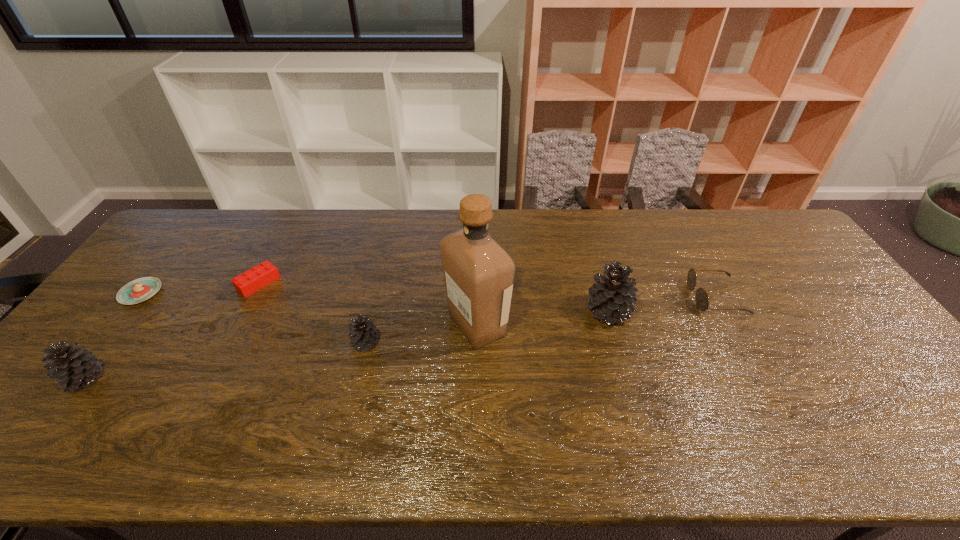
Where is `the leftmost pinecone`? This screenshot has width=960, height=540. the leftmost pinecone is located at coordinates (74, 367).

Where is `the third tallest object`? This screenshot has height=540, width=960. the third tallest object is located at coordinates (74, 367).

At what (x,y) coordinates should I click in order to perform the action: click on the shortest pinecone. Please return your answer as a coordinate pair (x, y). This screenshot has height=540, width=960. Looking at the image, I should click on (363, 334).

At what (x,y) coordinates should I click in order to perform the action: click on the fourth tallest object. Please return your answer as a coordinate pair (x, y). This screenshot has height=540, width=960. Looking at the image, I should click on (363, 334).

Image resolution: width=960 pixels, height=540 pixels. I want to click on the tallest pinecone, so click(x=612, y=298).

Where is `the sixth shortest object`? the sixth shortest object is located at coordinates (612, 298).

The height and width of the screenshot is (540, 960). What are the coordinates of `the third object from left to right` in the screenshot? It's located at (250, 281).

Where is `Lego`? This screenshot has width=960, height=540. Lego is located at coordinates click(250, 281).

Identify the location of the tallest object. Image resolution: width=960 pixels, height=540 pixels. click(478, 273).

Locate an element on the screen. The height and width of the screenshot is (540, 960). liquor is located at coordinates (478, 273).